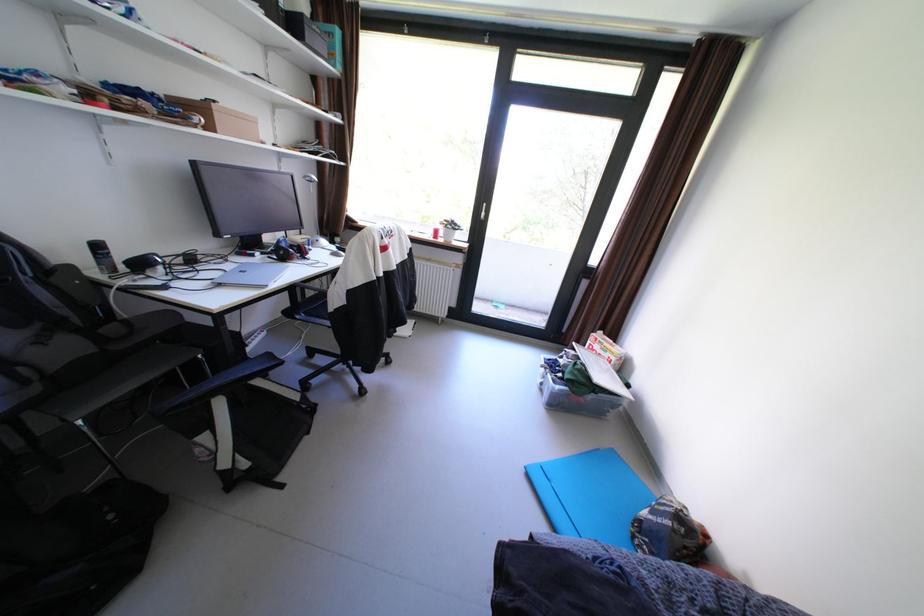
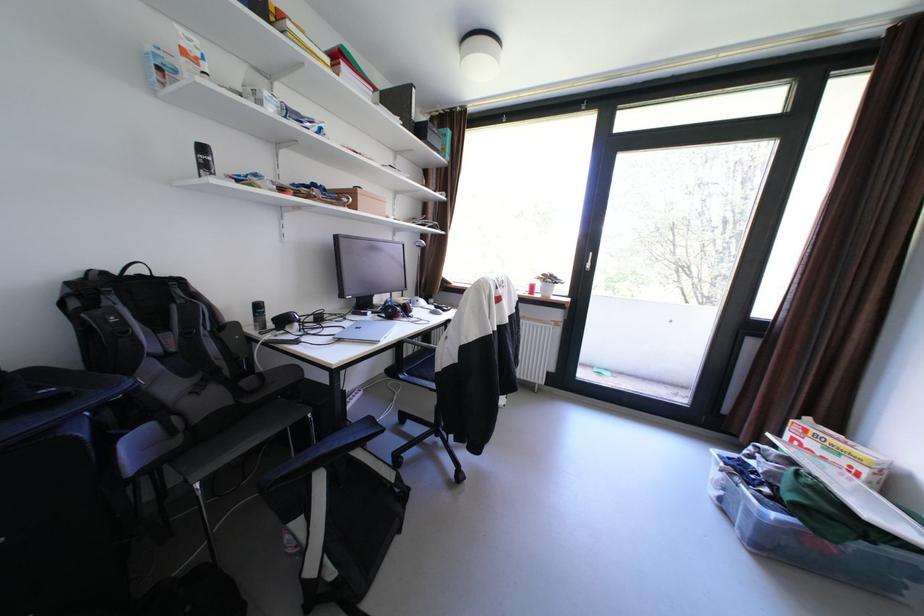
In the second image, find the point that corresponds to point (226, 116) in the first image.

(370, 197)